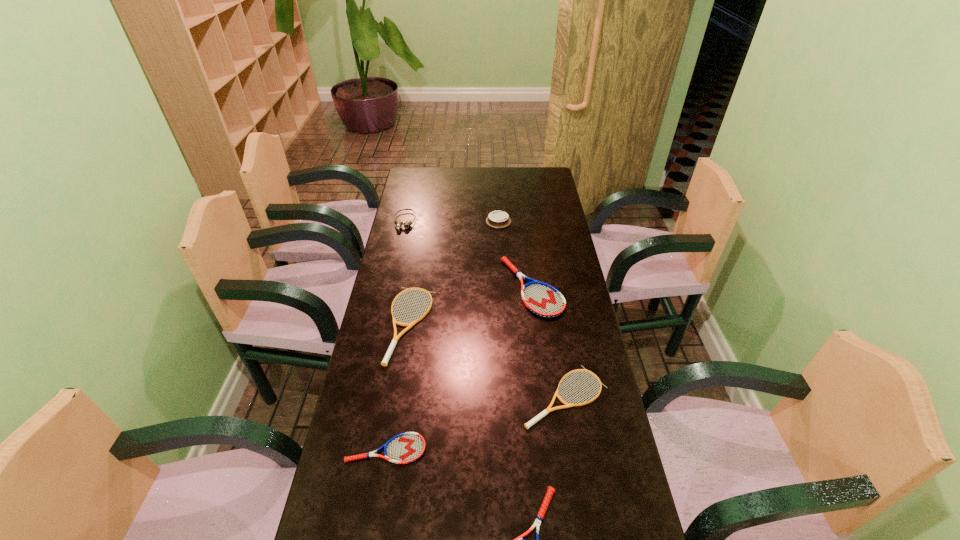
Identify the location of free space located 0.360m on the back of the left beige tennis racket. Image resolution: width=960 pixels, height=540 pixels. (425, 230).

Find the location of a particular element. free region located on the back of the right beige tennis racket is located at coordinates (549, 297).

At what (x,y) coordinates should I click in order to perform the action: click on vacant space located 0.050m on the back of the shortest tennis racket. Please return your answer as a coordinate pair (x, y). Looking at the image, I should click on (392, 417).

This screenshot has height=540, width=960. I want to click on goggles situated at the left edge, so click(x=399, y=224).

Where is `vacant region at the far edge`? This screenshot has width=960, height=540. vacant region at the far edge is located at coordinates (495, 175).

The width and height of the screenshot is (960, 540). In the image, there is a desktop. In order to click on vacant space at the left edge in this screenshot , I will do `click(418, 260)`.

This screenshot has width=960, height=540. Identify the location of vacant area at the right edge of the desktop. (564, 259).

Find the location of a particular element. The height and width of the screenshot is (540, 960). vacant space at the far left corner is located at coordinates [410, 192].

Identify the location of blank region between the biggest blue tennis racket and the goggles. (468, 254).

Find the location of a particular element. The width and height of the screenshot is (960, 540). vacant area that lies between the goggles and the chocolate cake is located at coordinates (451, 221).